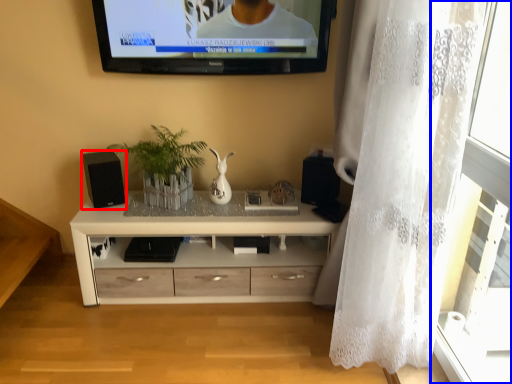
Question: Which of the following is the closest to the observer, speaker (highlighted by a red box) or glass door (highlighted by a blue box)?

Choices:
 (A) speaker
 (B) glass door

Answer: (B)